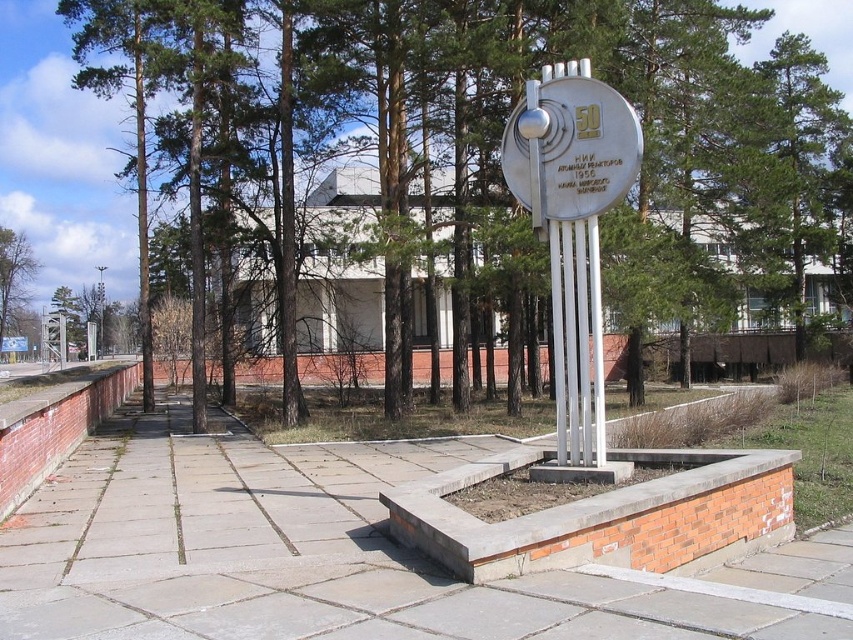
Question: Among these objects, which one is nearest to the camera?

Choices:
 (A) green leafy tree at center
 (B) gray concrete pavement at center
 (C) green leafy tree at left

Answer: (B)

Question: Is gray concrete pavement at center positioned in front of green leafy tree at left?

Choices:
 (A) yes
 (B) no

Answer: (A)

Question: Can you confirm if gray concrete pavement at center is smaller than green leafy tree at center?

Choices:
 (A) no
 (B) yes

Answer: (B)

Question: Which of the following is the farthest from the observer?

Choices:
 (A) (141, 246)
 (B) (267, 563)
 (C) (22, 257)

Answer: (C)

Question: Which point is farther from the camera taking this photo?

Choices:
 (A) (225, 288)
 (B) (22, 241)
 (C) (15, 588)

Answer: (B)

Question: Can you confirm if gray concrete pavement at center is bigger than green leafy tree at center?

Choices:
 (A) yes
 (B) no

Answer: (B)